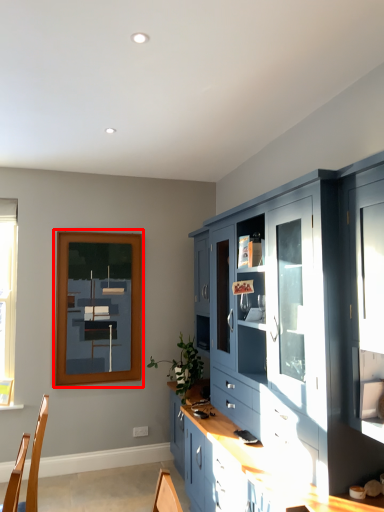
Question: Observing the image, what is the correct spatial positioning of picture frame (annotated by the red box) in reference to cabinetry?

Choices:
 (A) left
 (B) right

Answer: (A)